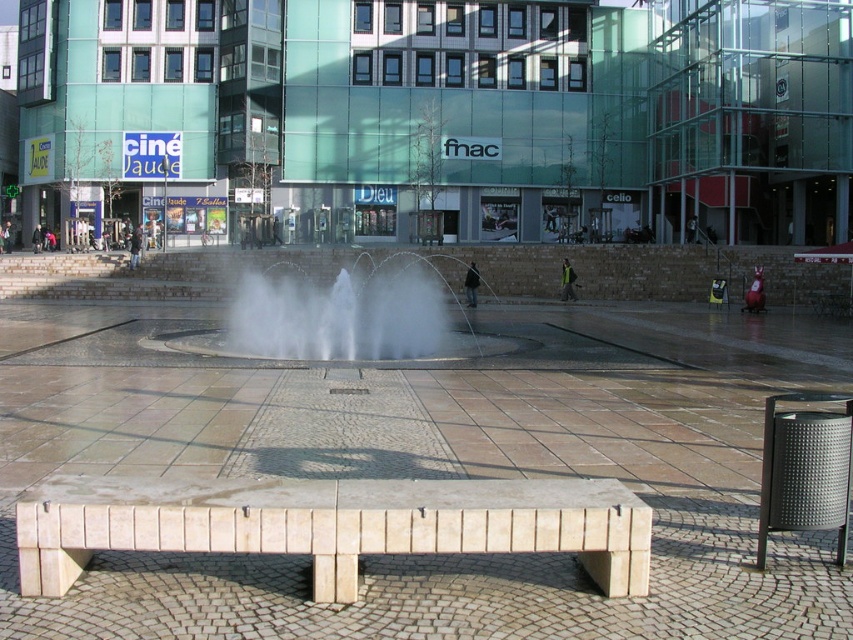
From the picture: Who is more forward, (207, 77) or (398, 275)?

Point (398, 275) is more forward.

Where is `green glass building at upper center`? The height and width of the screenshot is (640, 853). green glass building at upper center is located at coordinates (445, 115).

Is green glass building at upper center positioned before white stone bench at center?

No, green glass building at upper center is further to the viewer.

Is green glass building at upper center bigger than white stone bench at center?

Correct, green glass building at upper center is larger in size than white stone bench at center.

Between point (236, 161) and point (329, 563), which one is positioned in front?

Point (329, 563) is more forward.

Locate an element on the screen. green glass building at upper center is located at coordinates (445, 115).

Who is more forward, (x=529, y=481) or (x=436, y=317)?

Point (x=529, y=481) is more forward.

Is white stone bench at center to the right of clear water at center from the viewer's perspective?

Correct, you'll find white stone bench at center to the right of clear water at center.

Is point (64, 502) farther from camera compared to point (352, 346)?

No, (64, 502) is in front of (352, 346).

Find the location of a particular element. white stone bench at center is located at coordinates (332, 524).